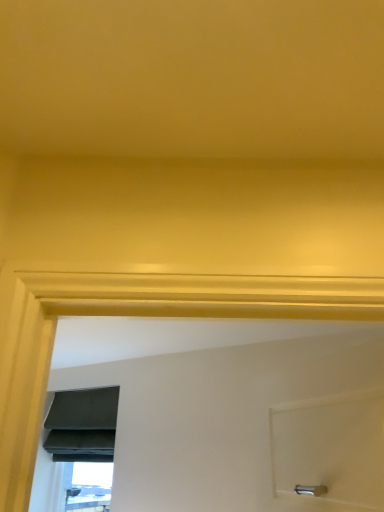
Consider the image. How much space does matte black window at lower left, the 1th window in the bottom-to-top sequence, occupy horizontally?

4.97 inches.

I want to click on matte black window at lower left, the 1th window in the bottom-to-top sequence, so click(x=90, y=487).

What do you see at coordinates (90, 487) in the screenshot? Image resolution: width=384 pixels, height=512 pixels. I see `matte black window at lower left, which is counted as the 2th window, starting from the top` at bounding box center [90, 487].

Describe the element at coordinates (83, 440) in the screenshot. I see `matte gray fabric at lower left, which is the 1th window from top to bottom` at that location.

Measure the distance between point (81, 490) and camera.

Point (81, 490) is 3.50 meters away from camera.

This screenshot has height=512, width=384. I want to click on matte gray fabric at lower left, which is the 1th window from top to bottom, so click(83, 440).

You are a GUI agent. You are given a task and a screenshot of the screen. Output one action in this format:
    pyautogui.click(x=<x>, y=<y>)
    Task: Click on the matte black window at lower left, the 1th window in the bottom-to-top sequence
    This screenshot has width=384, height=512.
    Given the screenshot: What is the action you would take?
    pyautogui.click(x=90, y=487)

Between matte black window at lower left, which is counted as the 2th window, starting from the top, and matte gray fabric at lower left, which is the second window from bottom to top, which one appears on the right side from the viewer's perspective?

Positioned to the right is matte black window at lower left, which is counted as the 2th window, starting from the top.

Which object is closer to the camera taking this photo, matte black window at lower left, the 1th window in the bottom-to-top sequence, or matte gray fabric at lower left, which is the second window from bottom to top?

Positioned in front is matte gray fabric at lower left, which is the second window from bottom to top.

Is point (108, 481) farther from camera compared to point (106, 387)?

Yes, it is.

From the image's perspective, between matte black window at lower left, which is counted as the 2th window, starting from the top, and matte gray fabric at lower left, which is the second window from bottom to top, which one is located above?

matte gray fabric at lower left, which is the second window from bottom to top, from the image's perspective.

From a real-world perspective, does matte black window at lower left, the 1th window in the bottom-to-top sequence, stand above matte gray fabric at lower left, which is the 1th window from top to bottom?

No, from a real-world perspective, matte black window at lower left, the 1th window in the bottom-to-top sequence, is not over matte gray fabric at lower left, which is the 1th window from top to bottom

Considering the sizes of matte black window at lower left, the 1th window in the bottom-to-top sequence, and matte gray fabric at lower left, which is the second window from bottom to top, in the image, is matte black window at lower left, the 1th window in the bottom-to-top sequence, wider or thinner than matte gray fabric at lower left, which is the second window from bottom to top,?

Considering their sizes, matte black window at lower left, the 1th window in the bottom-to-top sequence, looks slimmer than matte gray fabric at lower left, which is the second window from bottom to top.

Is matte black window at lower left, the 1th window in the bottom-to-top sequence, shorter than matte gray fabric at lower left, which is the second window from bottom to top?

Correct, matte black window at lower left, the 1th window in the bottom-to-top sequence, is not as tall as matte gray fabric at lower left, which is the second window from bottom to top.

Does matte black window at lower left, which is counted as the 2th window, starting from the top, have a larger size compared to matte gray fabric at lower left, which is the second window from bottom to top?

No.

Is matte black window at lower left, which is counted as the 2th window, starting from the top, situated inside matte gray fabric at lower left, which is the second window from bottom to top, or outside?

matte black window at lower left, which is counted as the 2th window, starting from the top, is spatially situated outside matte gray fabric at lower left, which is the second window from bottom to top.

Is matte black window at lower left, the 1th window in the bottom-to-top sequence, aimed at matte gray fabric at lower left, which is the second window from bottom to top?

No.

Can you tell me how much matte black window at lower left, the 1th window in the bottom-to-top sequence, and matte gray fabric at lower left, which is the 1th window from top to bottom, differ in facing direction?

The angle between the facing direction of matte black window at lower left, the 1th window in the bottom-to-top sequence, and the facing direction of matte gray fabric at lower left, which is the 1th window from top to bottom, is 0.000302 degrees.

How much distance is there between matte black window at lower left, the 1th window in the bottom-to-top sequence, and matte gray fabric at lower left, which is the 1th window from top to bottom?

A distance of 23.97 centimeters exists between matte black window at lower left, the 1th window in the bottom-to-top sequence, and matte gray fabric at lower left, which is the 1th window from top to bottom.

Where is `window below the matte gray fabric at lower left, which is the 1th window from top to bottom (from a real-world perspective)`? The width and height of the screenshot is (384, 512). window below the matte gray fabric at lower left, which is the 1th window from top to bottom (from a real-world perspective) is located at coordinates (90, 487).

Which object is positioned more to the left, matte gray fabric at lower left, which is the second window from bottom to top, or matte black window at lower left, which is counted as the 2th window, starting from the top?

Positioned to the left is matte gray fabric at lower left, which is the second window from bottom to top.

Is matte gray fabric at lower left, which is the second window from bottom to top, further to camera compared to matte black window at lower left, which is counted as the 2th window, starting from the top?

No, it is in front of matte black window at lower left, which is counted as the 2th window, starting from the top.

Which is behind, point (104, 422) or point (108, 511)?

The point (104, 422) is farther.

From the image's perspective, is matte gray fabric at lower left, which is the 1th window from top to bottom, on top of matte black window at lower left, the 1th window in the bottom-to-top sequence?

Correct, matte gray fabric at lower left, which is the 1th window from top to bottom, appears higher than matte black window at lower left, the 1th window in the bottom-to-top sequence, in the image.

From a real-world perspective, is matte gray fabric at lower left, which is the second window from bottom to top, under matte black window at lower left, the 1th window in the bottom-to-top sequence?

No, from a real-world perspective, matte gray fabric at lower left, which is the second window from bottom to top, is not below matte black window at lower left, the 1th window in the bottom-to-top sequence.

Is matte gray fabric at lower left, which is the second window from bottom to top, wider or thinner than matte black window at lower left, the 1th window in the bottom-to-top sequence?

Considering their sizes, matte gray fabric at lower left, which is the second window from bottom to top, looks broader than matte black window at lower left, the 1th window in the bottom-to-top sequence.

Looking at this image, considering the sizes of objects matte gray fabric at lower left, which is the second window from bottom to top, and matte black window at lower left, the 1th window in the bottom-to-top sequence, in the image provided, who is shorter, matte gray fabric at lower left, which is the second window from bottom to top, or matte black window at lower left, the 1th window in the bottom-to-top sequence,?

With less height is matte black window at lower left, the 1th window in the bottom-to-top sequence.

Considering the relative sizes of matte gray fabric at lower left, which is the 1th window from top to bottom, and matte black window at lower left, the 1th window in the bottom-to-top sequence, in the image provided, is matte gray fabric at lower left, which is the 1th window from top to bottom, smaller than matte black window at lower left, the 1th window in the bottom-to-top sequence,?

No.

Is matte gray fabric at lower left, which is the 1th window from top to bottom, not inside matte black window at lower left, the 1th window in the bottom-to-top sequence?

Yes.

Would you consider matte gray fabric at lower left, which is the second window from bottom to top, to be distant from matte black window at lower left, the 1th window in the bottom-to-top sequence?

That's not correct — matte gray fabric at lower left, which is the second window from bottom to top, is a little close to matte black window at lower left, the 1th window in the bottom-to-top sequence.

Is matte gray fabric at lower left, which is the 1th window from top to bottom, facing towards matte black window at lower left, the 1th window in the bottom-to-top sequence?

No, matte gray fabric at lower left, which is the 1th window from top to bottom, does not turn towards matte black window at lower left, the 1th window in the bottom-to-top sequence.

How far apart are matte gray fabric at lower left, which is the 1th window from top to bottom, and matte black window at lower left, the 1th window in the bottom-to-top sequence?

matte gray fabric at lower left, which is the 1th window from top to bottom, and matte black window at lower left, the 1th window in the bottom-to-top sequence, are 23.97 centimeters apart from each other.

Where is `window above the matte black window at lower left, which is counted as the 2th window, starting from the top (from a real-world perspective)`? The height and width of the screenshot is (512, 384). window above the matte black window at lower left, which is counted as the 2th window, starting from the top (from a real-world perspective) is located at coordinates (83, 440).

Identify the location of window behind the matte gray fabric at lower left, which is the 1th window from top to bottom. (90, 487).

This screenshot has width=384, height=512. Identify the location of window on the right of the matte gray fabric at lower left, which is the 1th window from top to bottom. (90, 487).